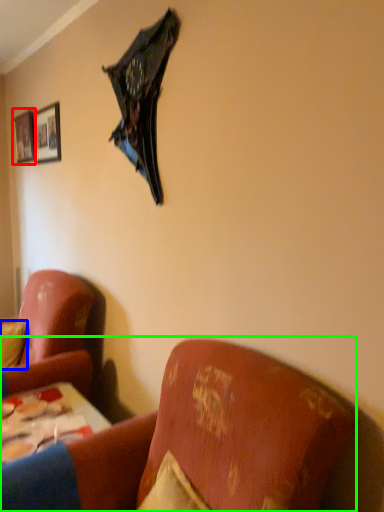
Question: Which object is positioned farthest from picture frame (highlighted by a red box)? Select from pillow (highlighted by a blue box) and studio couch (highlighted by a green box).

Choices:
 (A) pillow
 (B) studio couch

Answer: (B)